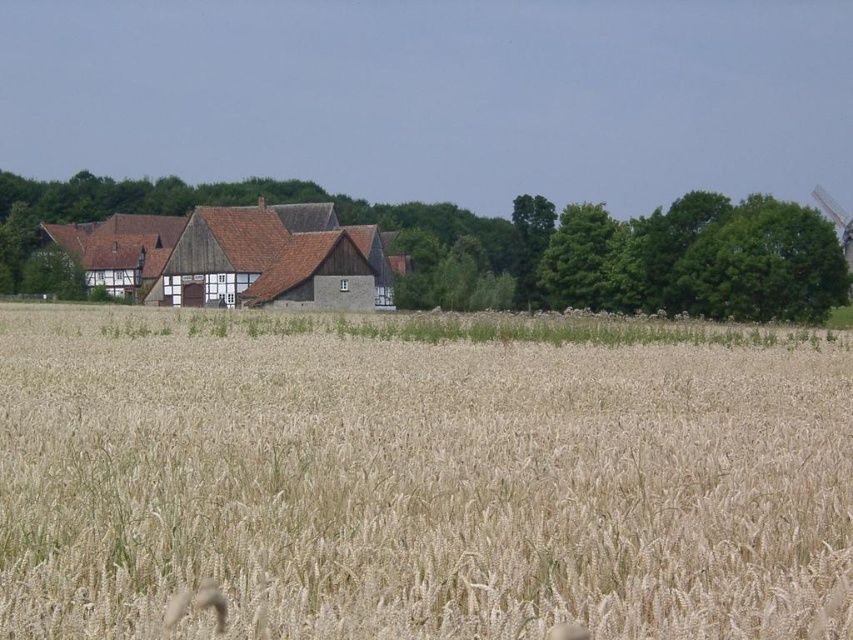
Question: Among these points, which one is farthest from the camera?

Choices:
 (A) (440, 392)
 (B) (289, 259)

Answer: (B)

Question: Is golden wheat field at center thinner than brown wooden barn at center?

Choices:
 (A) yes
 (B) no

Answer: (A)

Question: Can you confirm if golden wheat field at center is positioned below brown wooden barn at center?

Choices:
 (A) no
 (B) yes

Answer: (B)

Question: Among these points, which one is nearest to the camera?

Choices:
 (A) (389, 304)
 (B) (234, 448)

Answer: (B)

Question: Can you confirm if golden wheat field at center is positioned to the right of brown wooden barn at center?

Choices:
 (A) no
 (B) yes

Answer: (B)